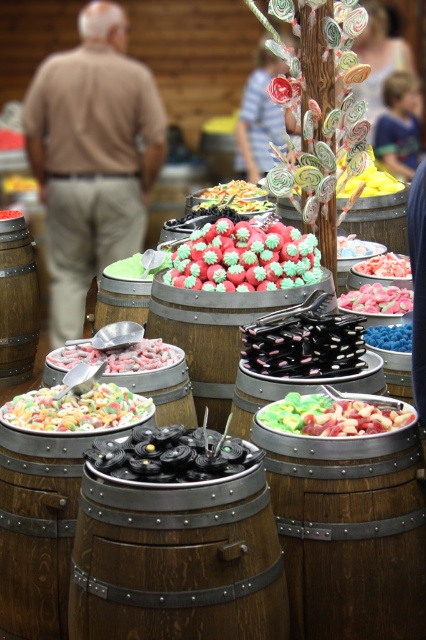
You are at a candy fair and want to choose between the green frosted strawberries at center and the white candy at center. Which one is bigger?

The green frosted strawberries at center is larger in size compared to the white candy at center.

Looking at this image, you are standing at the origin point of the coordinate system in the candy display. Where is the pastel candy mix at center located?

The pastel candy mix at center is located at the coordinate point of 0.641 on the x axis and 0.178 on the y axis.

You are a customer at the candy display and want to grab a candy from the blue matte candy at center without touching the blonde hair at upper right. Is this possible?

The blonde hair at upper right might be wider than blue matte candy at center, so there is a possibility that they are close enough that reaching for the blue matte candy at center could accidentally touch the blonde hair at upper right. To avoid contact, ensure you reach carefully or choose a candy further away from the blonde hair at upper right.